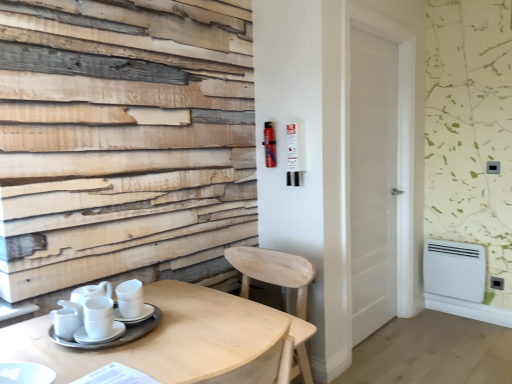
In the scene shown: Measure the distance between point (122, 312) and camera.

1.49 meters.

Locate an element on the screen. This screenshot has height=384, width=512. white glossy cups at lower left is located at coordinates (66, 320).

Describe the element at coordinates (135, 317) in the screenshot. The image size is (512, 384). I see `white ceramic saucer at table` at that location.

This screenshot has width=512, height=384. What do you see at coordinates (454, 269) in the screenshot? I see `white plastic radiator at lower right` at bounding box center [454, 269].

Find the location of `white glossy cup at center`. white glossy cup at center is located at coordinates (130, 298).

Is white glossy cup at center taller or shorter than white glossy cups at lower left?

white glossy cup at center is taller than white glossy cups at lower left.

Considering the sizes of objects white glossy cup at center and white glossy cups at lower left in the image provided, who is wider, white glossy cup at center or white glossy cups at lower left?

With larger width is white glossy cups at lower left.

Is white glossy cup at center beside white glossy cups at lower left?

No, white glossy cup at center is not making contact with white glossy cups at lower left.

Does white glossy cup at center have a larger size compared to white glossy cups at lower left?

Yes.

Considering the sizes of objects white plastic radiator at lower right and white glossy cup at center in the image provided, who is shorter, white plastic radiator at lower right or white glossy cup at center?

Standing shorter between the two is white glossy cup at center.

This screenshot has width=512, height=384. In order to click on coffee cup located on the left of white plastic radiator at lower right in this screenshot , I will do `click(130, 298)`.

Considering the relative positions of white plastic radiator at lower right and white glossy cup at center in the image provided, is white plastic radiator at lower right to the left of white glossy cup at center from the viewer's perspective?

Incorrect, white plastic radiator at lower right is not on the left side of white glossy cup at center.

Which object is more forward, white plastic radiator at lower right or white glossy cup at center?

white glossy cup at center.

Is light wood chair at lower center further to camera compared to white wooden door at center?

No, light wood chair at lower center is in front of white wooden door at center.

Choose the correct answer: Is light wood chair at lower center inside white wooden door at center or outside it?

light wood chair at lower center cannot be found inside white wooden door at center.

Does light wood chair at lower center have a lesser height compared to white wooden door at center?

Correct, light wood chair at lower center is not as tall as white wooden door at center.

From a real-world perspective, which is physically above, light wood chair at lower center or white wooden door at center?

white wooden door at center.

Locate an element on the screen. The height and width of the screenshot is (384, 512). tableware above the white plastic radiator at lower right (from the image's perspective) is located at coordinates (66, 320).

Is white plastic radiator at lower right far away from white glossy cups at lower left?

Yes, white plastic radiator at lower right is far from white glossy cups at lower left.

Which is less distant, (425, 242) or (75, 311)?

Positioned in front is point (75, 311).

Based on their positions, is white plastic radiator at lower right located to the left or right of white glossy cups at lower left?

In the image, white plastic radiator at lower right appears on the right side of white glossy cups at lower left.

In terms of size, does white ceramic saucer at table appear bigger or smaller than white glossy cups at lower left?

white ceramic saucer at table is smaller than white glossy cups at lower left.

Is white glossy cups at lower left completely or partially inside white ceramic saucer at table?

Definitely not — white glossy cups at lower left is not inside white ceramic saucer at table.

Considering the relative sizes of white ceramic saucer at table and white glossy cups at lower left in the image provided, is white ceramic saucer at table shorter than white glossy cups at lower left?

Indeed, white ceramic saucer at table has a lesser height compared to white glossy cups at lower left.

This screenshot has width=512, height=384. In order to click on appliance below the light wood chair at lower center (from a real-world perspective) in this screenshot , I will do `click(454, 269)`.

Considering the relative sizes of light wood chair at lower center and white plastic radiator at lower right in the image provided, is light wood chair at lower center wider than white plastic radiator at lower right?

Yes.

From a real-world perspective, is light wood chair at lower center beneath white plastic radiator at lower right?

No, from a real-world perspective, light wood chair at lower center is not beneath white plastic radiator at lower right.

Can you tell me how much light wood chair at lower center and white plastic radiator at lower right differ in facing direction?

1.85 degrees separate the facing orientations of light wood chair at lower center and white plastic radiator at lower right.

Can you confirm if metallic red extinguisher at upper right is taller than white plastic radiator at lower right?

In fact, metallic red extinguisher at upper right may be shorter than white plastic radiator at lower right.

Does metallic red extinguisher at upper right come behind white plastic radiator at lower right?

No, metallic red extinguisher at upper right is closer to the viewer.

Is metallic red extinguisher at upper right positioned beyond the bounds of white plastic radiator at lower right?

Yes, metallic red extinguisher at upper right is not within white plastic radiator at lower right.

From the image's perspective, is metallic red extinguisher at upper right on white plastic radiator at lower right?

Yes, from the image's perspective, metallic red extinguisher at upper right is over white plastic radiator at lower right.

I want to click on tableware below the white glossy cup at center (from the image's perspective), so click(66, 320).

The height and width of the screenshot is (384, 512). I want to click on appliance below the white glossy cup at center (from a real-world perspective), so pyautogui.click(x=454, y=269).

When comparing their distances from white wooden door at center, does light wood table at lower left or light wood chair at lower center seem further?

The object further to white wooden door at center is light wood table at lower left.

Which object lies nearer to the anchor point white plastic radiator at lower right, white glossy cups at lower left or white glossy cup at center?

→ white glossy cup at center is positioned closer to the anchor white plastic radiator at lower right.

Considering their positions, is light wood table at lower left positioned closer to white ceramic saucer at table than white glossy cup at center?

white glossy cup at center lies closer to white ceramic saucer at table than the other object.

From the image, which object appears to be nearer to light wood chair at lower center, light wood table at lower left or white glossy cups at lower left?

light wood table at lower left.

Looking at the image, which one is located closer to white plastic radiator at lower right, light wood chair at lower center or light wood table at lower left?

light wood chair at lower center.

Based on their spatial positions, is white plastic radiator at lower right or white wooden door at center further from white glossy cup at center?

Based on the image, white plastic radiator at lower right appears to be further to white glossy cup at center.

Based on their spatial positions, is metallic red extinguisher at upper right or white glossy cup at center further from white ceramic saucer at table?

Among the two, metallic red extinguisher at upper right is located further to white ceramic saucer at table.

Which object lies further to the anchor point light wood table at lower left, white glossy cups at lower left or white ceramic saucer at table?

Based on the image, white glossy cups at lower left appears to be further to light wood table at lower left.

This screenshot has height=384, width=512. In order to click on coffee cup between white ceramic saucer at table and metallic red extinguisher at upper right from front to back in this screenshot , I will do 130,298.

Find the location of a particular element. The image size is (512, 384). coffee cup located between white glossy cups at lower left and white plastic radiator at lower right in the left-right direction is located at coordinates 130,298.

Locate an element on the screen. The width and height of the screenshot is (512, 384). coffee cup between light wood chair at lower center and metallic red extinguisher at upper right along the z-axis is located at coordinates (130, 298).

I want to click on saucer situated between white glossy cups at lower left and white plastic radiator at lower right from left to right, so click(x=135, y=317).